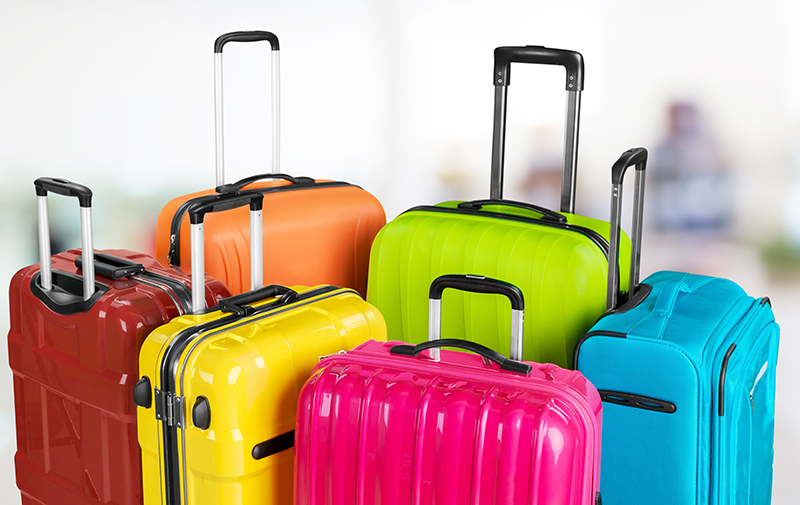
I want to click on adjustable handles, so click(470, 277), click(217, 204), click(64, 185), click(246, 35), click(568, 61), click(625, 162).